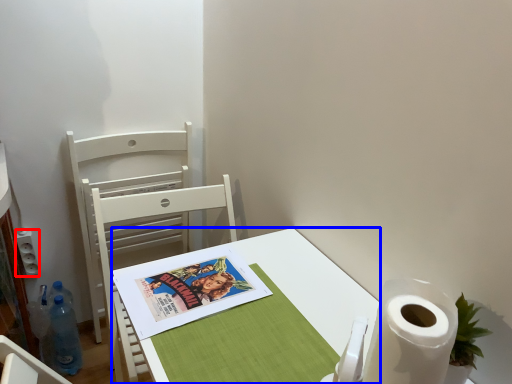
Question: Among these objects, which one is nearest to the camera, power outlet (highlighted by a red box) or desk (highlighted by a blue box)?

Choices:
 (A) power outlet
 (B) desk

Answer: (B)